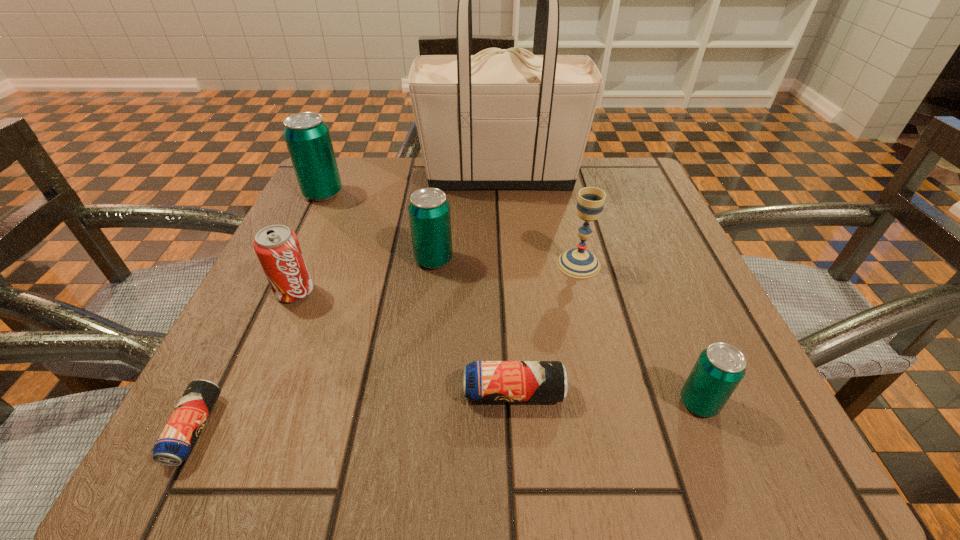
The height and width of the screenshot is (540, 960). Identify the location of beer can present at the right edge. (719, 369).

Identify the location of object positioned at the far left corner. The image size is (960, 540). (307, 137).

Locate an element on the screen. The image size is (960, 540). object present at the near left corner is located at coordinates (178, 438).

Identify the location of object that is at the far right corner. The image size is (960, 540). (506, 119).

The height and width of the screenshot is (540, 960). I want to click on object that is at the near right corner, so click(x=719, y=369).

Where is `free spot at the far edge of the desktop`? Image resolution: width=960 pixels, height=540 pixels. free spot at the far edge of the desktop is located at coordinates (564, 205).

Locate an element on the screen. The height and width of the screenshot is (540, 960). blank space at the near edge is located at coordinates (532, 407).

I want to click on free space at the left edge of the desktop, so click(275, 351).

The image size is (960, 540). In order to click on free location at the right edge of the desktop in this screenshot , I will do `click(643, 236)`.

You are a GUI agent. You are given a task and a screenshot of the screen. Output one action in this format:
    pyautogui.click(x=<x>, y=<y>)
    Task: Click on the vacant space at the far left corner
    This screenshot has height=540, width=960.
    Given the screenshot: What is the action you would take?
    pyautogui.click(x=334, y=214)